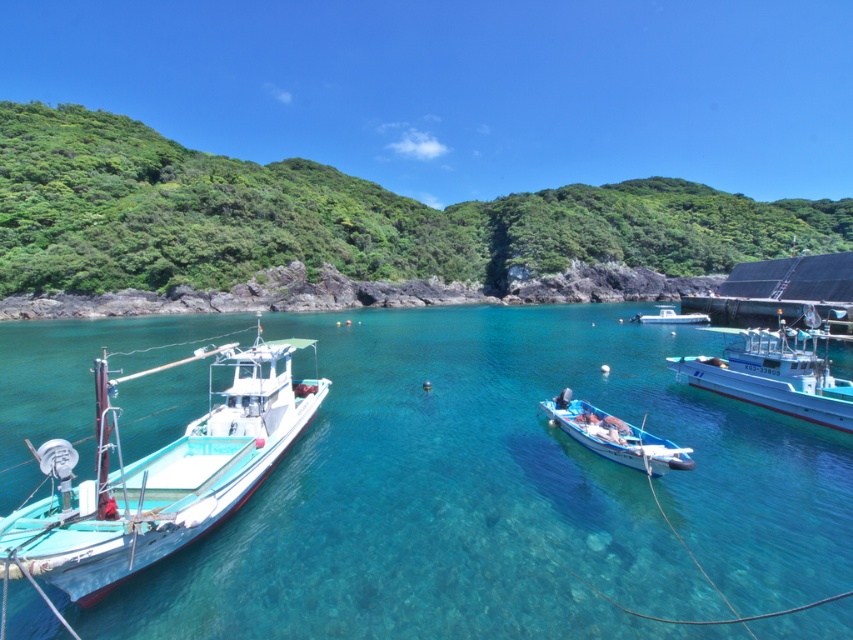
You are standing at the center of the scene and want to locate the point marked at coordinates (160,474). Which object in the image does this point belong to?

The point marked at coordinates (160,474) is located on the teal matte boat at left.

You are a photographer standing on the shore and want to capture both the teal matte boat at left and the white glossy boat at center in your shot. Which boat will appear closer to you in the photo?

The teal matte boat at left will appear closer to you in the photo because it is positioned in front of the white glossy boat at center.

You are a photographer standing on the shore and want to take a photo of the clear blue water at center and the white glossy boat at right. Which object is located to the right of the other?

The white glossy boat at right is positioned to the right of the clear blue water at center.